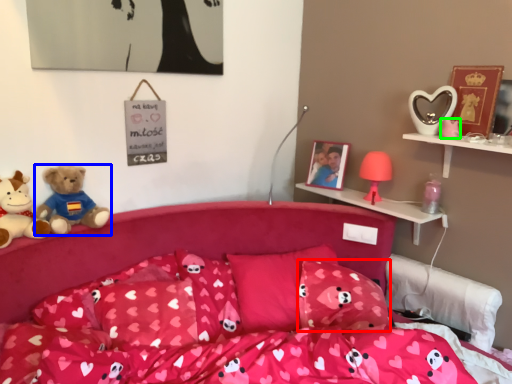
Question: Which is farther away from pillow (highlighted by a red box)? teddy bear (highlighted by a blue box) or toy (highlighted by a green box)?

Choices:
 (A) teddy bear
 (B) toy

Answer: (A)